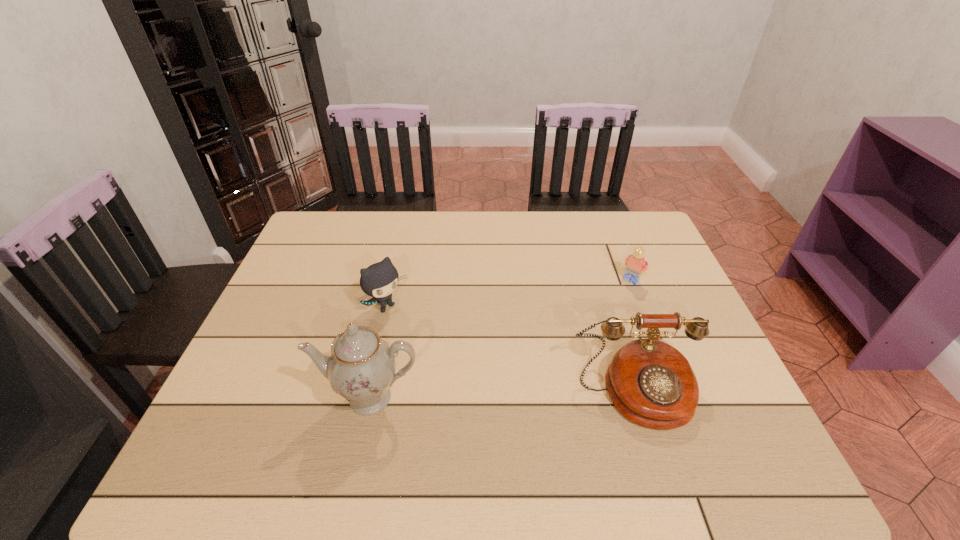
The height and width of the screenshot is (540, 960). Identify the location of vacant area located on the front-facing side of the Lego. (564, 357).

Where is `vacant area situated 0.210m on the front-facing side of the Lego`? vacant area situated 0.210m on the front-facing side of the Lego is located at coordinates [589, 328].

This screenshot has height=540, width=960. Identify the location of chinaware that is at the near edge. (361, 368).

Where is `telephone at the near edge`? Image resolution: width=960 pixels, height=540 pixels. telephone at the near edge is located at coordinates (651, 383).

You are a GUI agent. You are given a task and a screenshot of the screen. Output one action in this format:
    pyautogui.click(x=<x>, y=<y>)
    Task: Click on the telephone at the right edge
    The image size is (960, 540).
    Given the screenshot: What is the action you would take?
    pyautogui.click(x=651, y=383)

At what (x,y) coordinates should I click in order to perform the action: click on Lego that is at the right edge. Please return your answer as a coordinate pair (x, y). This screenshot has width=960, height=540. Looking at the image, I should click on (635, 264).

The height and width of the screenshot is (540, 960). In order to click on object present at the near right corner in this screenshot , I will do `click(651, 383)`.

Locate an element on the screen. vacant space at the far edge is located at coordinates pos(508,242).

Find the location of a particular element. vacant space at the near edge is located at coordinates (396, 408).

What are the coordinates of `blank space at the left edge of the desktop` in the screenshot? It's located at (304, 301).